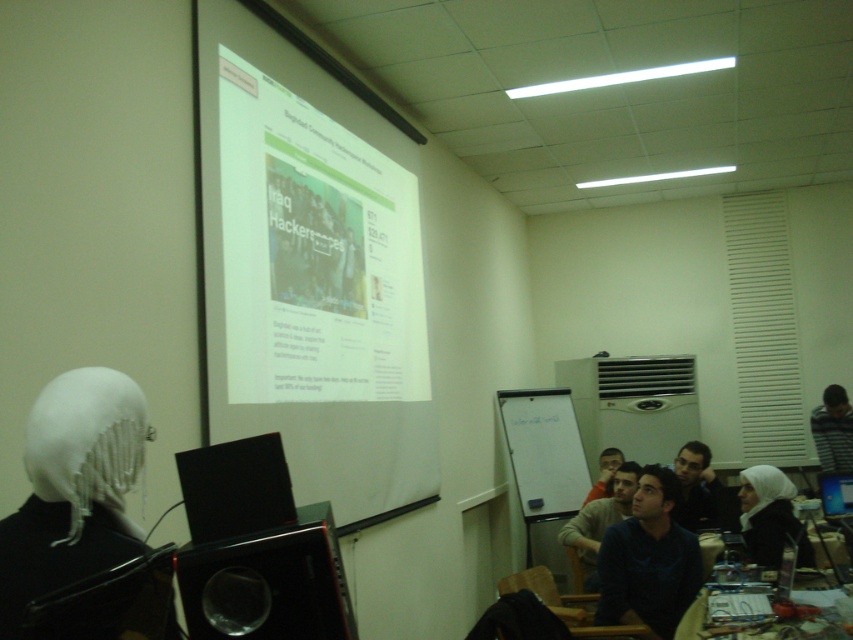
Question: Can you confirm if dark blue shirt at center is smaller than dark blue sweater at center?

Choices:
 (A) no
 (B) yes

Answer: (B)

Question: From the image, what is the correct spatial relationship of dark blue shirt at center in relation to matte black laptop at center?

Choices:
 (A) above
 (B) below

Answer: (A)

Question: Can you confirm if striped sweater at right is smaller than matte black laptop at center?

Choices:
 (A) no
 (B) yes

Answer: (A)

Question: Which object is positioned closest to the white matte headscarf at left?

Choices:
 (A) wooden table at lower right
 (B) white matte projection screen at upper center
 (C) striped sweater at right

Answer: (B)

Question: Estimate the real-world distances between objects in this image. Which object is farther from the dark blue shirt at lower right?

Choices:
 (A) white matte hijab at center
 (B) black matte computer screen at lower left
 (C) striped sweater at right

Answer: (B)

Question: Considering the real-world distances, which object is closest to the white matte projection screen at upper center?

Choices:
 (A) whiteboard at center
 (B) matte black laptop at center
 (C) dark blue sweater at center

Answer: (C)